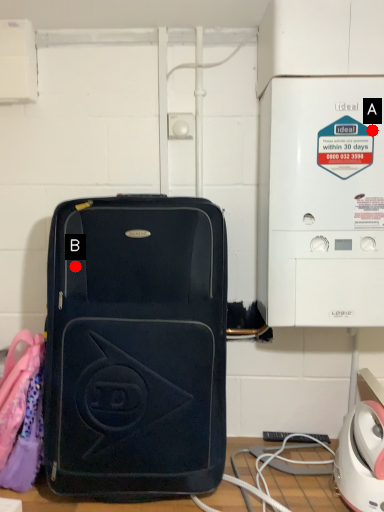
Question: Two points are circled on the image, labeled by A and B beside each circle. Which point is closer to the camera?

Choices:
 (A) A is closer
 (B) B is closer

Answer: (A)